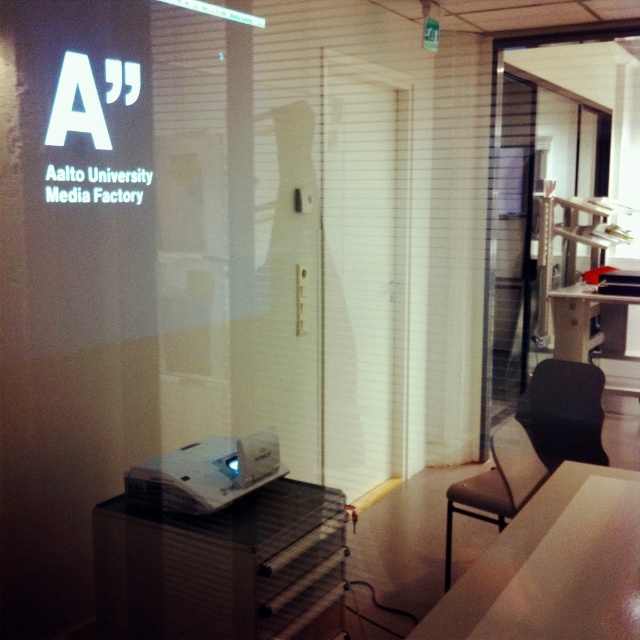
Question: Which point is farther to the camera?

Choices:
 (A) black leather chair at right
 (B) glossy plastic table at center

Answer: (B)

Question: Is white glossy table at lower right positioned before black leather chair at right?

Choices:
 (A) yes
 (B) no

Answer: (A)

Question: Which of the following is the farthest from the observer?

Choices:
 (A) (628, 586)
 (B) (605, 42)

Answer: (B)

Question: Which object is the closest to the white glossy table at lower right?

Choices:
 (A) black leather chair at right
 (B) white plastic projector at lower center

Answer: (A)

Question: Can you confirm if white glossy table at lower right is bigger than glossy plastic table at center?

Choices:
 (A) no
 (B) yes

Answer: (A)

Question: Does transparent glass door at upper right appear under glossy plastic table at center?

Choices:
 (A) yes
 (B) no

Answer: (B)